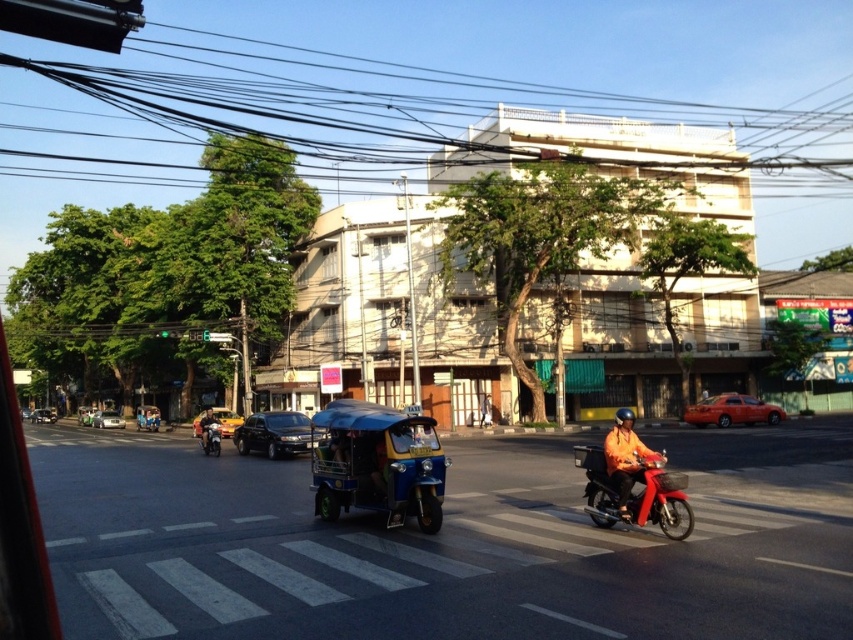
Question: Does shiny black sedan at center appear over orange fabric helmet at center?

Choices:
 (A) no
 (B) yes

Answer: (B)

Question: Which is farther from the orange fabric motorbike at center?

Choices:
 (A) blue matte tricycle at center
 (B) yellow metallic taxi at center

Answer: (B)

Question: Which object is farther from the camera taking this photo?

Choices:
 (A) shiny black sedan at center
 (B) orange matte helmet at center
 (C) yellow metallic taxi at center

Answer: (C)

Question: Which is farther from the matte black sedan at center?

Choices:
 (A) orange matte taxi at center right
 (B) shiny black sedan at center
 (C) black wire at upper center
 (D) yellow metallic taxi at center

Answer: (C)

Question: Can you confirm if yellow metallic taxi at center is positioned above matte black sedan at center?

Choices:
 (A) no
 (B) yes

Answer: (B)

Question: Does blue matte tricycle at center appear over yellow metallic taxi at center?

Choices:
 (A) no
 (B) yes

Answer: (B)